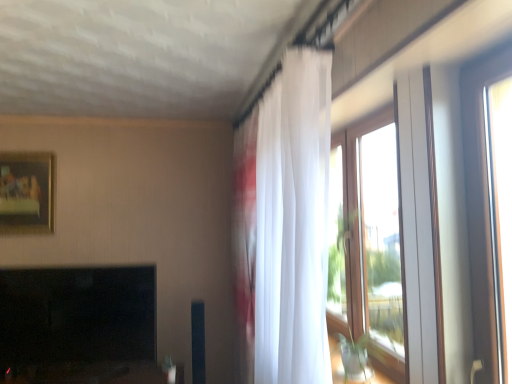
Question: Is white sheer curtain at upper right located outside clear glass window at right?

Choices:
 (A) no
 (B) yes

Answer: (B)

Question: From the image's perspective, is white sheer curtain at upper right on top of clear glass window at right?

Choices:
 (A) no
 (B) yes

Answer: (A)

Question: Is white sheer curtain at upper right to the left of clear glass window at right from the viewer's perspective?

Choices:
 (A) yes
 (B) no

Answer: (A)

Question: Is white sheer curtain at upper right thinner than clear glass window at right?

Choices:
 (A) yes
 (B) no

Answer: (B)

Question: From the image's perspective, is white sheer curtain at upper right below clear glass window at right?

Choices:
 (A) no
 (B) yes

Answer: (B)

Question: Is black glossy fireplace at lower left taller or shorter than clear glass window at right?

Choices:
 (A) short
 (B) tall

Answer: (A)

Question: In the image, is black glossy fireplace at lower left positioned in front of or behind clear glass window at right?

Choices:
 (A) front
 (B) behind

Answer: (B)

Question: Is black glossy fireplace at lower left to the left or to the right of clear glass window at right in the image?

Choices:
 (A) right
 (B) left

Answer: (B)

Question: In terms of size, does black glossy fireplace at lower left appear bigger or smaller than clear glass window at right?

Choices:
 (A) small
 (B) big

Answer: (B)

Question: From the image's perspective, is matte gold picture frame at upper left above or below clear glass window at right?

Choices:
 (A) below
 (B) above

Answer: (B)

Question: From a real-world perspective, relative to clear glass window at right, is matte gold picture frame at upper left vertically above or below?

Choices:
 (A) above
 (B) below

Answer: (A)

Question: Is matte gold picture frame at upper left wider or thinner than clear glass window at right?

Choices:
 (A) thin
 (B) wide

Answer: (A)

Question: Looking at the image, does matte gold picture frame at upper left seem bigger or smaller compared to clear glass window at right?

Choices:
 (A) big
 (B) small

Answer: (B)

Question: In terms of height, does black glossy fireplace at lower left look taller or shorter compared to matte gold picture frame at upper left?

Choices:
 (A) short
 (B) tall

Answer: (B)

Question: Considering the positions of black glossy fireplace at lower left and matte gold picture frame at upper left in the image, is black glossy fireplace at lower left wider or thinner than matte gold picture frame at upper left?

Choices:
 (A) wide
 (B) thin

Answer: (A)